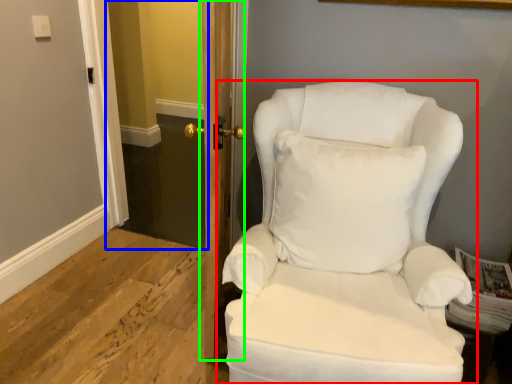
Question: Which object is positioned farthest from chair (highlighted by a red box)? Select from glass door (highlighted by a blue box) and door (highlighted by a green box).

Choices:
 (A) glass door
 (B) door

Answer: (A)